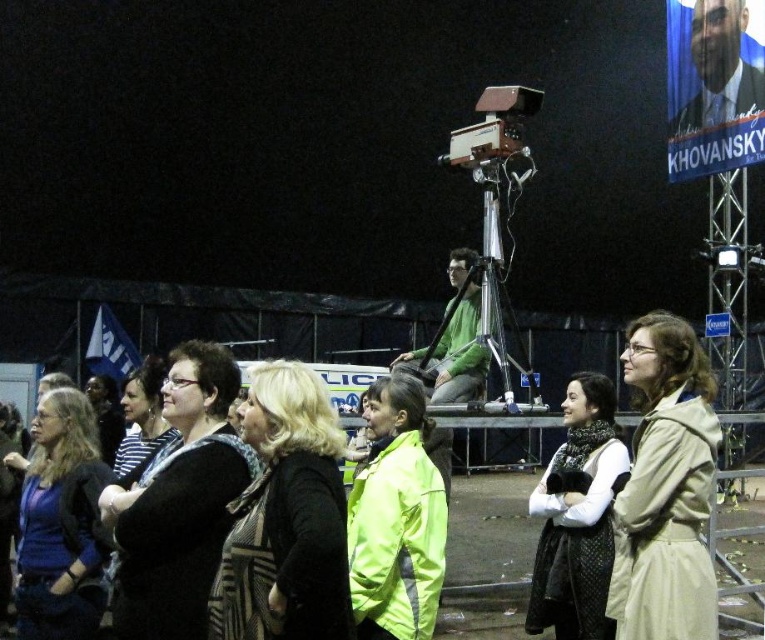
Question: Can you confirm if beige fabric coat at right is positioned below matte black jacket at lower left?

Choices:
 (A) no
 (B) yes

Answer: (A)

Question: Among these points, which one is farthest from the camera?

Choices:
 (A) (601, 458)
 (B) (278, 369)
 (C) (210, 493)
 (D) (41, 452)

Answer: (A)

Question: Based on their relative distances, which object is farther from the black knitwear at center?

Choices:
 (A) black textured scarf at center
 (B) beige fabric coat at right
 (C) matte black jacket at center

Answer: (B)

Question: Can you confirm if knitted scarf at center is positioned to the left of matte black jacket at center?

Choices:
 (A) yes
 (B) no

Answer: (B)

Question: Which point is farther to the camera?

Choices:
 (A) knitted scarf at center
 (B) matte black jacket at center
 (C) beige fabric coat at right
 (D) matte black jacket at lower left

Answer: (A)

Question: Does black knitwear at center come behind matte black jacket at center?

Choices:
 (A) no
 (B) yes

Answer: (A)